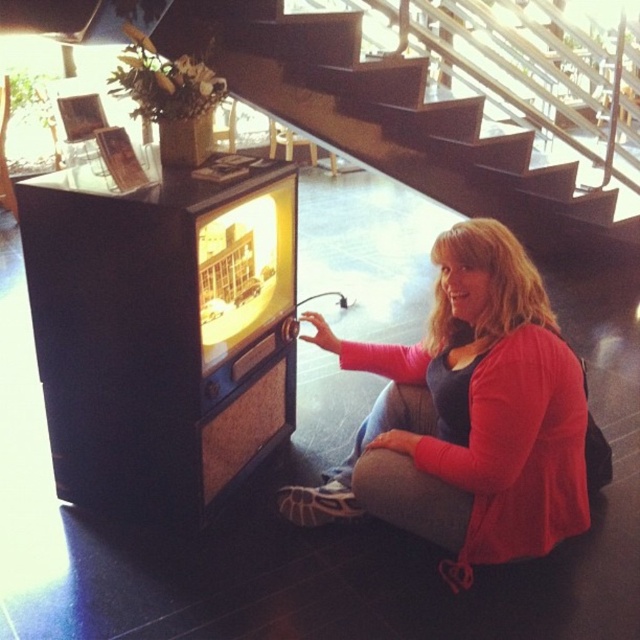
Describe the element at coordinates (484, 410) in the screenshot. I see `pink fabric at lower center` at that location.

Who is more distant from viewer, (387, 445) or (257, 8)?

Positioned behind is point (257, 8).

Which is behind, point (412, 353) or point (326, 83)?

The point (326, 83) is more distant.

Where is `pink fabric at lower center`? pink fabric at lower center is located at coordinates (484, 410).